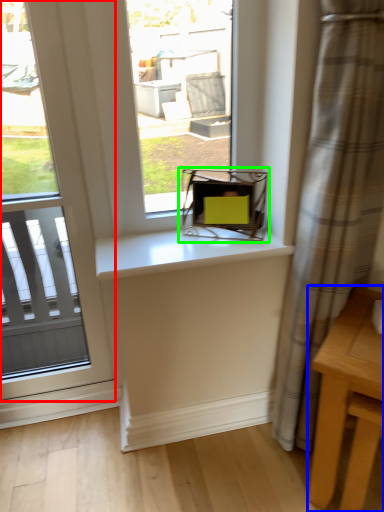
Question: Based on their relative distances, which object is farther from window (highlighted by a red box)? Choose from table (highlighted by a blue box) and chair (highlighted by a green box).

Choices:
 (A) table
 (B) chair

Answer: (A)